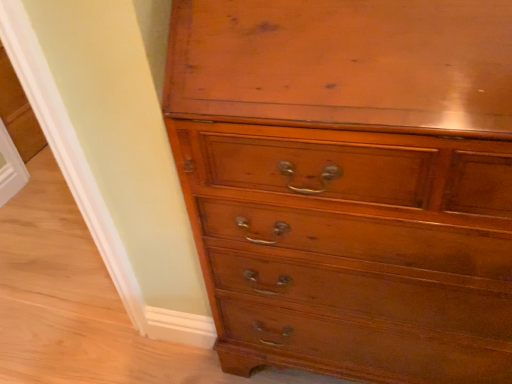
Question: From a real-world perspective, is shiny brown wood chest of drawers at center positioned above or below white plastic screen door at lower left?

Choices:
 (A) above
 (B) below

Answer: (A)

Question: Is shiny brown wood chest of drawers at center wider or thinner than white plastic screen door at lower left?

Choices:
 (A) wide
 (B) thin

Answer: (A)

Question: Considering their positions, is shiny brown wood chest of drawers at center located in front of or behind white plastic screen door at lower left?

Choices:
 (A) front
 (B) behind

Answer: (A)

Question: In the image, is white plastic screen door at lower left positioned in front of or behind shiny brown wood chest of drawers at center?

Choices:
 (A) front
 (B) behind

Answer: (B)

Question: From a real-world perspective, is white plastic screen door at lower left positioned above or below shiny brown wood chest of drawers at center?

Choices:
 (A) above
 (B) below

Answer: (B)

Question: Based on their sizes in the image, would you say white plastic screen door at lower left is bigger or smaller than shiny brown wood chest of drawers at center?

Choices:
 (A) small
 (B) big

Answer: (A)

Question: From the image's perspective, is white plastic screen door at lower left above or below shiny brown wood chest of drawers at center?

Choices:
 (A) above
 (B) below

Answer: (A)